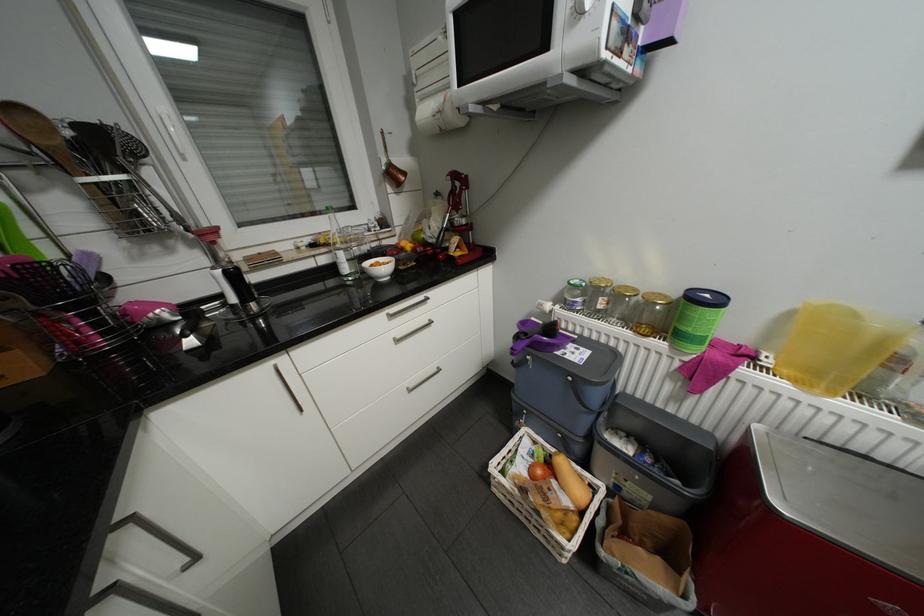
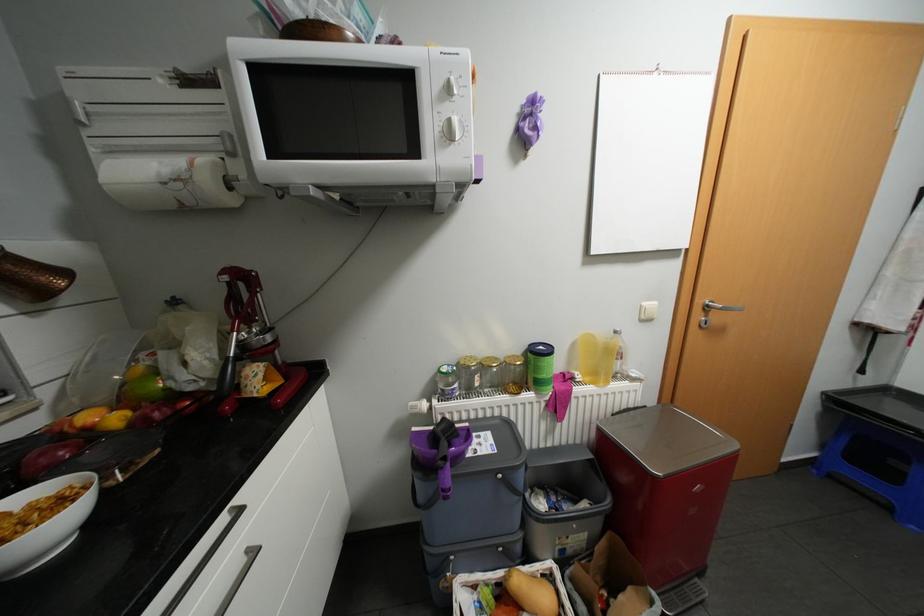
The point at (642, 289) is marked in the first image. Where is the corresponding point in the second image?

(504, 358)